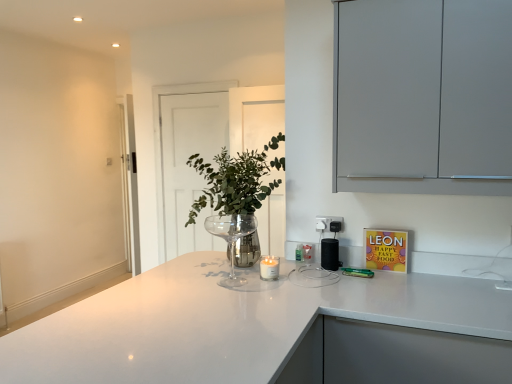
Question: Is black plastic electric outlet at upper right taller or shorter than green leafy plant at center?

Choices:
 (A) short
 (B) tall

Answer: (A)

Question: Is black plastic electric outlet at upper right wider or thinner than green leafy plant at center?

Choices:
 (A) thin
 (B) wide

Answer: (A)

Question: Considering the real-world distances, which object is farthest from the transparent glass door at center?

Choices:
 (A) green leafy plant at center
 (B) black plastic electric outlet at upper right
 (C) black plastic speaker at center
 (D) white glossy countertop at center
 (E) clear glass wine glass at center

Answer: (D)

Question: Which is nearer to the transparent glass door at center?

Choices:
 (A) white glossy countertop at center
 (B) black plastic speaker at center
 (C) green leafy plant at center
 (D) matte gray cabinet at upper right
 (E) black plastic electric outlet at upper right

Answer: (C)